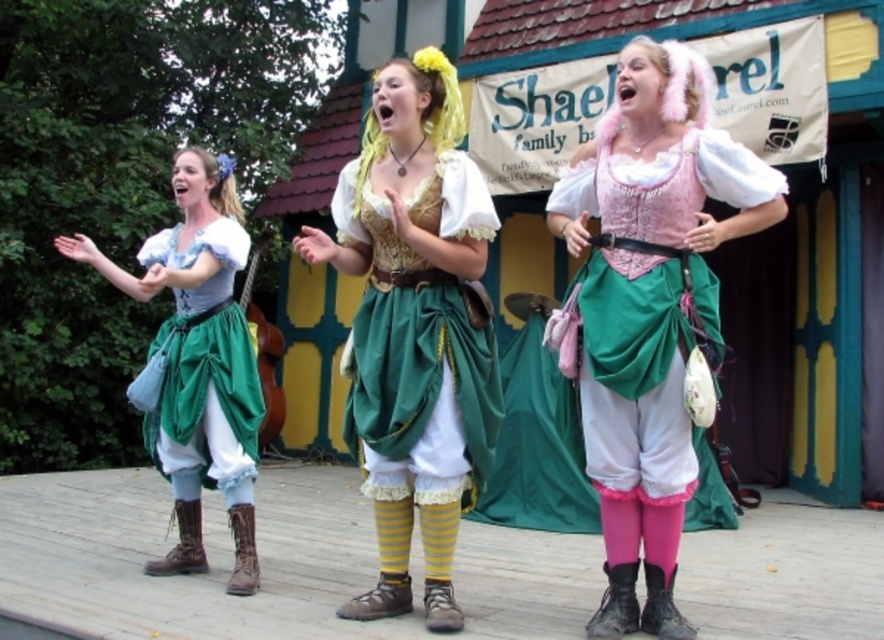
You are an audience member sitting in the front row of the stage. You notice two points marked on the stage. The first point is at coordinate point [226,332] and the second is at point [697,109]. Which point is closer to you?

Point [226,332] is closer to you than point [697,109] because it is further to the viewer according to the description.